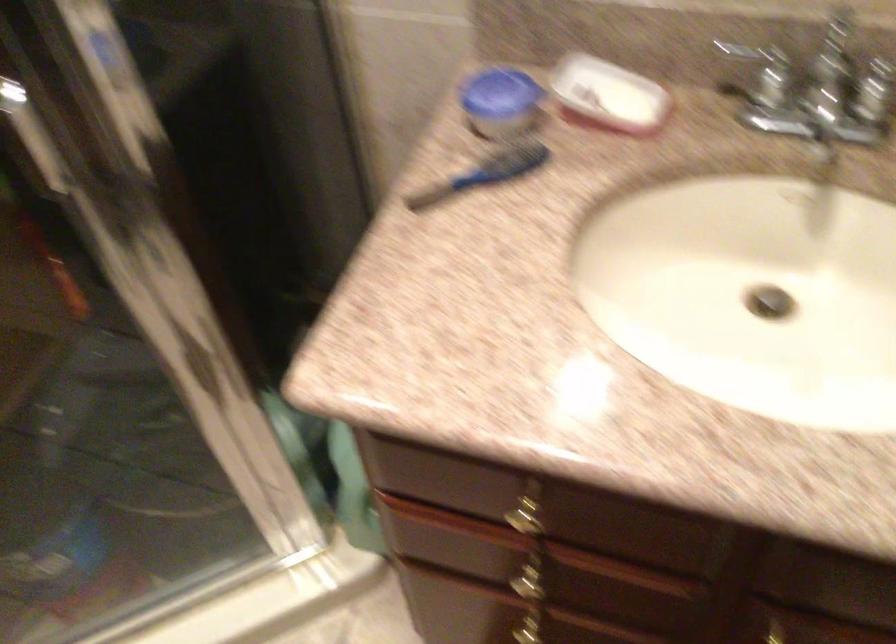
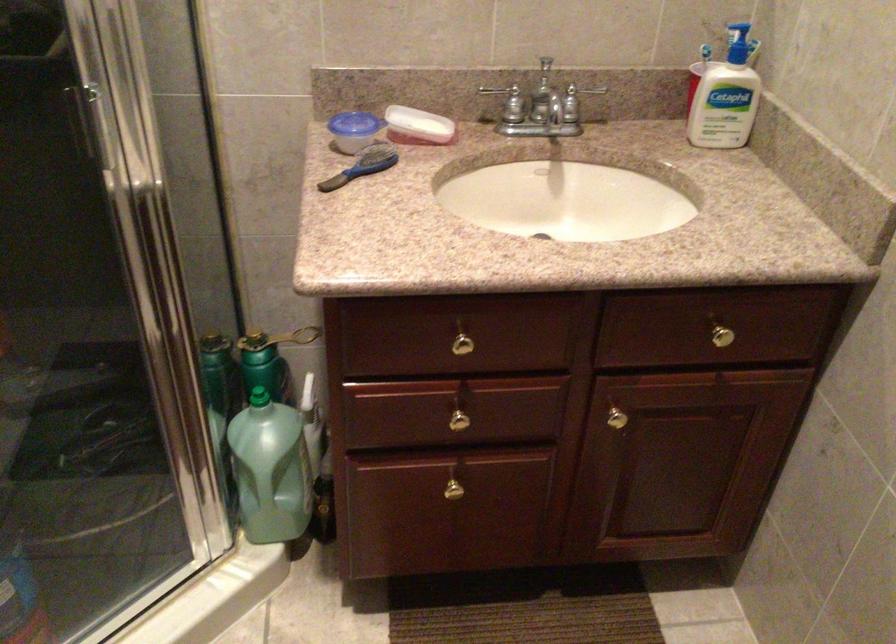
Where in the second image is the point corresponding to the point at 606,102 from the first image?

(418, 126)